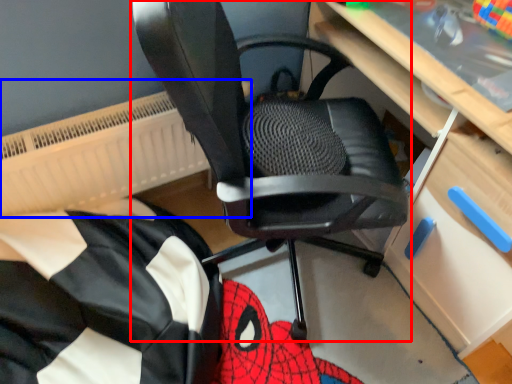
Question: Which object is closer to the camera taking this photo, chair (highlighted by a red box) or radiator (highlighted by a blue box)?

Choices:
 (A) chair
 (B) radiator

Answer: (A)